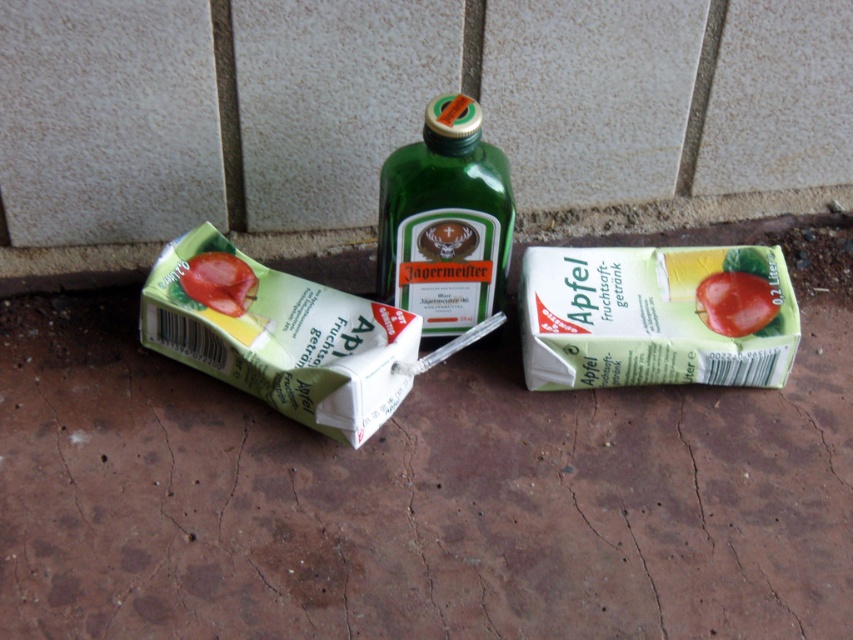
Does point (717, 276) lie behind point (247, 305)?

Yes, it is behind point (247, 305).

Does glossy red apple at center have a greater width compared to glossy plastic tomato at lower left?

Indeed, glossy red apple at center has a greater width compared to glossy plastic tomato at lower left.

Describe the element at coordinates (735, 301) in the screenshot. The width and height of the screenshot is (853, 640). I see `glossy red apple at center` at that location.

Image resolution: width=853 pixels, height=640 pixels. Identify the location of glossy red apple at center. (735, 301).

Is green matte carton at center to the right of green glass bottle at center from the viewer's perspective?

Indeed, green matte carton at center is positioned on the right side of green glass bottle at center.

Is green matte carton at center below green glass bottle at center?

Yes, green matte carton at center is below green glass bottle at center.

The width and height of the screenshot is (853, 640). What do you see at coordinates (656, 316) in the screenshot?
I see `green matte carton at center` at bounding box center [656, 316].

Where is `green matte carton at center`? The height and width of the screenshot is (640, 853). green matte carton at center is located at coordinates (656, 316).

Can you confirm if green matte carton at center is positioned to the left of glossy plastic tomato at lower left?

Incorrect, green matte carton at center is not on the left side of glossy plastic tomato at lower left.

Who is more distant from viewer, [729,307] or [181,278]?

The point [729,307] is behind.

Locate an element on the screen. green matte carton at center is located at coordinates (656, 316).